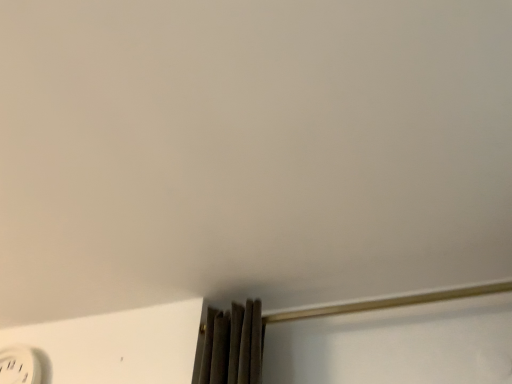
The image size is (512, 384). What do you see at coordinates (19, 366) in the screenshot?
I see `white plastic power plugs and sockets at lower left` at bounding box center [19, 366].

The image size is (512, 384). Identify the location of white plastic power plugs and sockets at lower left. (19, 366).

Find the location of a particular element. This screenshot has width=512, height=384. white plastic power plugs and sockets at lower left is located at coordinates (19, 366).